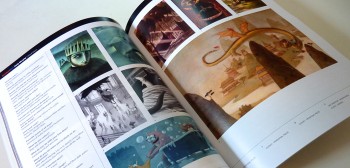
Locate an element on the screen. Image resolution: width=350 pixels, height=168 pixels. left side of open book is located at coordinates (124, 106).